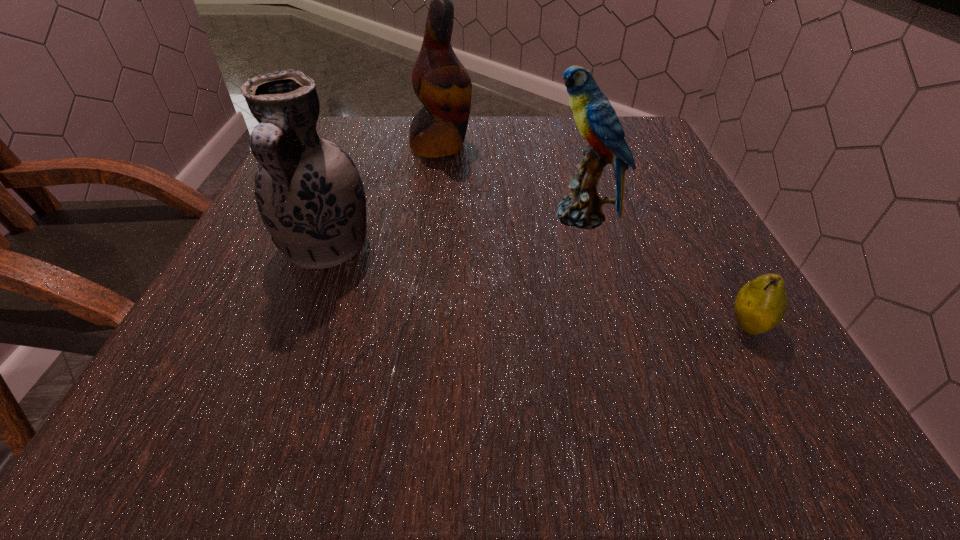
In the image, there is a desktop. What are the coordinates of `blank space at the right edge` in the screenshot? It's located at (689, 305).

In the image, there is a desktop. Where is `vacant space at the near left corner`? vacant space at the near left corner is located at coordinates (232, 386).

In the image, there is a desktop. At what (x,y) coordinates should I click in order to perform the action: click on free space at the far right corner. Please return your answer as a coordinate pair (x, y). The width and height of the screenshot is (960, 540). Looking at the image, I should click on (626, 120).

Image resolution: width=960 pixels, height=540 pixels. I want to click on free space at the near right corner of the desktop, so click(x=736, y=408).

Image resolution: width=960 pixels, height=540 pixels. Identify the location of unoccupied position between the leftmost object and the third object from right to left. (384, 197).

Locate an element on the screen. The width and height of the screenshot is (960, 540). vacant region between the shorter parrot and the leftmost object is located at coordinates (454, 232).

This screenshot has width=960, height=540. I want to click on free space between the second object from right to left and the leftmost object, so click(x=454, y=232).

Where is `free space between the leftmost object and the shortest object`? This screenshot has height=540, width=960. free space between the leftmost object and the shortest object is located at coordinates (538, 287).

Locate an element on the screen. The width and height of the screenshot is (960, 540). empty space between the vase and the pear is located at coordinates (538, 287).

Locate an element on the screen. This screenshot has height=540, width=960. vacant space that's between the shortest object and the vase is located at coordinates (538, 287).